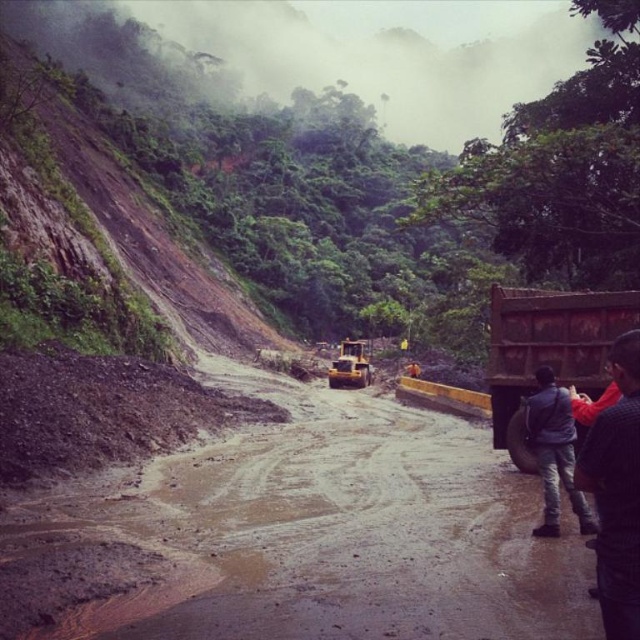
You are a hiker trying to navigate through this mountainous area. You need to cross the brown muddy dirt track at center and reach the brown rocky hillside at upper left. Given that the distance between them is 102.41 feet, can you estimate how long it would take you to walk this distance if your average walking speed is 3 feet per second?

The distance between the brown muddy dirt track at center and the brown rocky hillside at upper left is 102.41 feet. At a walking speed of 3 feet per second, it would take approximately 34.14 seconds to cover this distance. Therefore, it would take roughly 34 seconds to walk from the brown muddy dirt track at center to the brown rocky hillside at upper left.

You are a hiker who just arrived at this muddy mountain road. You see a rusty metal truck at right and a dark gray sweater at lower right. Which object is higher up from the ground?

The rusty metal truck at right is above dark gray sweater at lower right, so the truck is higher up from the ground.

You are a hiker trying to navigate the muddy road. You see the brown muddy dirt track at center and the dark gray jeans at lower right. Which object is located to the left of the other?

The brown muddy dirt track at center is positioned on the left side of dark gray jeans at lower right.